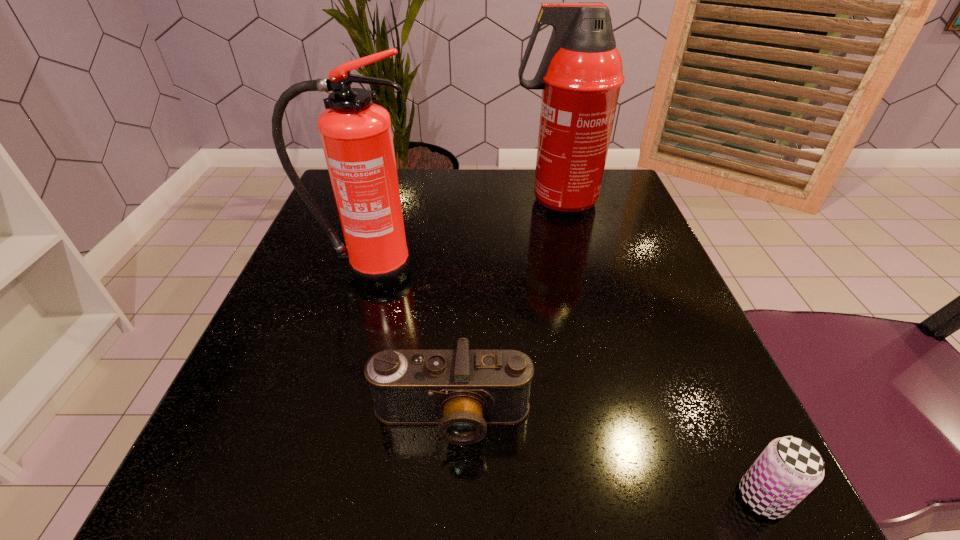
Image resolution: width=960 pixels, height=540 pixels. Identify the location of the second object from right to left. (581, 72).

I want to click on the right fire extinguisher, so click(x=581, y=72).

Find the location of a particular element. This screenshot has width=960, height=540. the second farthest object is located at coordinates (356, 135).

Where is `the left fire extinguisher`? The width and height of the screenshot is (960, 540). the left fire extinguisher is located at coordinates pos(356,135).

At what (x,y) coordinates should I click in order to perform the action: click on camera. Please return your answer as a coordinate pair (x, y). Image resolution: width=960 pixels, height=540 pixels. Looking at the image, I should click on (462, 391).

The image size is (960, 540). I want to click on the rightmost object, so click(789, 468).

Locate an element on the screen. This screenshot has width=960, height=540. the nearest object is located at coordinates (789, 468).

This screenshot has width=960, height=540. Find the location of `vacant area situated on the trigger side of the third object from left to right`. vacant area situated on the trigger side of the third object from left to right is located at coordinates (420, 200).

This screenshot has height=540, width=960. I want to click on vacant space positioned on the trigger side of the third object from left to right, so click(x=407, y=200).

Locate an element on the screen. The width and height of the screenshot is (960, 540). vacant area situated on the trigger side of the third object from left to right is located at coordinates (472, 200).